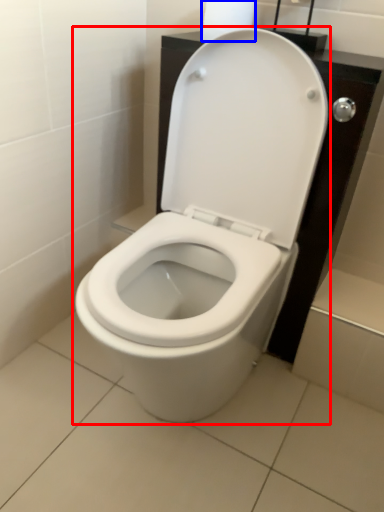
Question: Which object is further to the camera taking this photo, toilet (highlighted by a red box) or toilet paper (highlighted by a blue box)?

Choices:
 (A) toilet
 (B) toilet paper

Answer: (B)